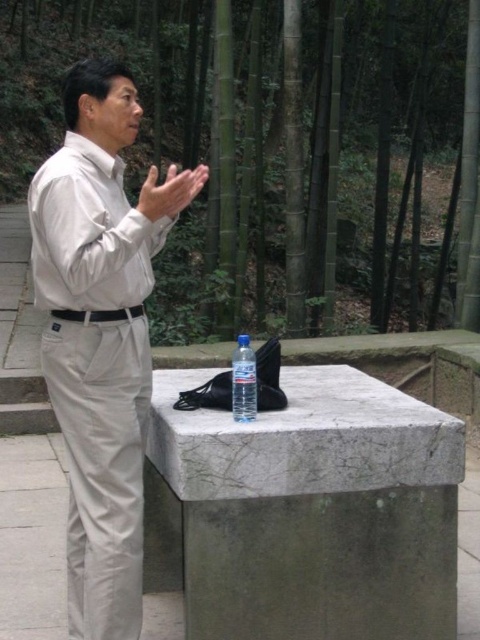
Question: Which point is farther to the camera?

Choices:
 (A) matte white hand at center
 (B) white smooth shirt at center
 (C) matte beige shirt at center
 (D) clear plastic bottle at center

Answer: (D)

Question: Does matte white hand at center appear under clear plastic bottle at center?

Choices:
 (A) yes
 (B) no

Answer: (B)

Question: Which object is farther from the camera taking this photo?

Choices:
 (A) matte beige shirt at center
 (B) clear plastic bottle at center
 (C) green bamboo forest at upper center

Answer: (C)

Question: Is white smooth shirt at center wider than matte white hand at center?

Choices:
 (A) no
 (B) yes

Answer: (A)

Question: Is the position of green bamboo forest at upper center more distant than that of white smooth shirt at center?

Choices:
 (A) yes
 (B) no

Answer: (A)

Question: Which object is farther from the camera taking this photo?

Choices:
 (A) matte beige shirt at center
 (B) clear plastic bottle at center
 (C) matte white hand at center
 (D) green bamboo forest at upper center

Answer: (D)